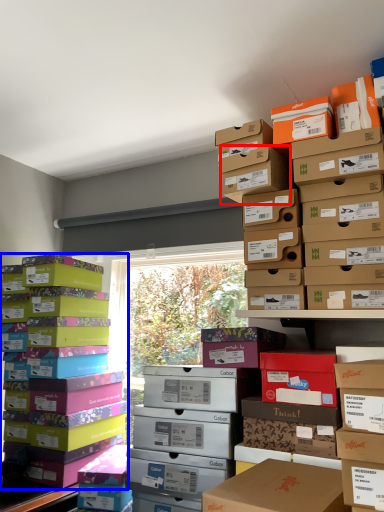
Question: Which object is closer to the camera taking this photo, storage box (highlighted by a red box) or box (highlighted by a blue box)?

Choices:
 (A) storage box
 (B) box

Answer: (A)